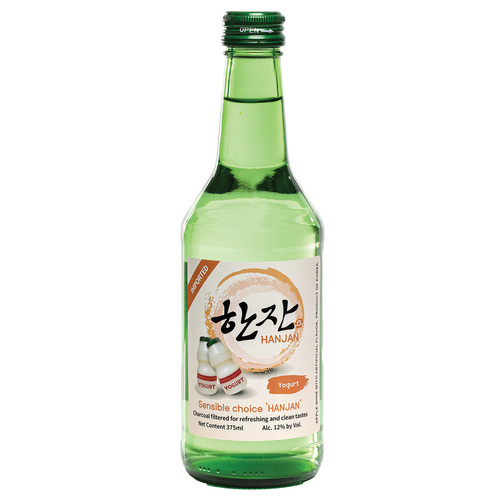
Locate an element on the screen. Image resolution: width=500 pixels, height=500 pixels. green glass bottle is located at coordinates (270, 448), (259, 187).